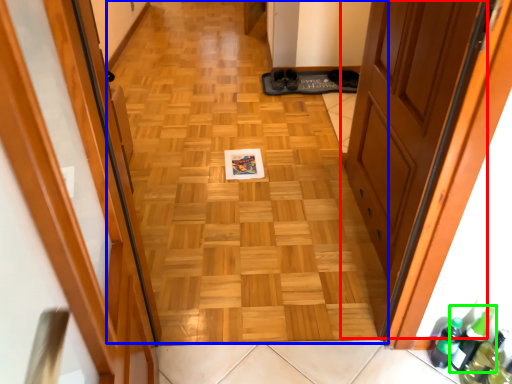
Question: Which is farther away from door (highlighted by a red box)? plain (highlighted by a blue box) or beer bottle (highlighted by a green box)?

Choices:
 (A) plain
 (B) beer bottle

Answer: (B)